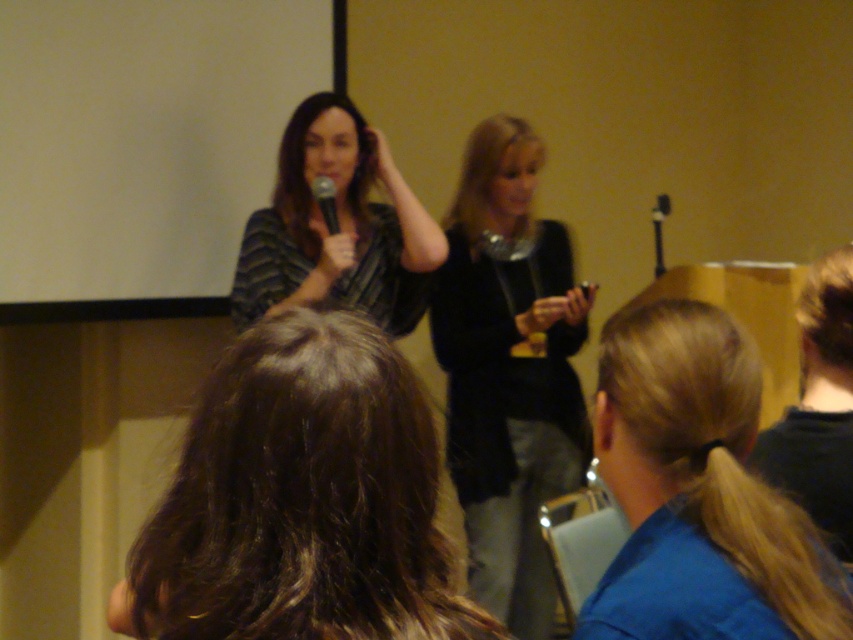
Between point (322, 561) and point (523, 310), which one is positioned behind?

Point (523, 310)

Which is more to the right, dark brown hair at upper center or black fuzzy sweater at center?

black fuzzy sweater at center is more to the right.

Is point (451, 596) more distant than point (467, 384)?

No, it is not.

Locate an element on the screen. dark brown hair at upper center is located at coordinates (300, 500).

Between point (340, 108) and point (323, 196), which one is positioned in front?

Positioned in front is point (323, 196).

Who is higher up, striped fabric shirt at center or black matte microphone at upper center?

black matte microphone at upper center is higher up.

Identify the location of striped fabric shirt at center. This screenshot has width=853, height=640. (340, 227).

Which of these two, black fuzzy sweater at center or striped fabric shirt at center, stands taller?

black fuzzy sweater at center is taller.

Between point (463, 529) and point (252, 218), which one is positioned behind?

Point (463, 529)

This screenshot has width=853, height=640. I want to click on black fuzzy sweater at center, so click(509, 374).